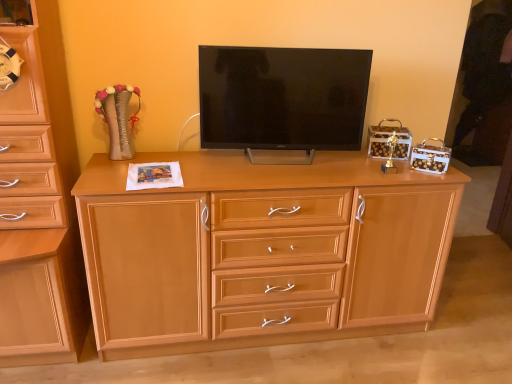
You are a GUI agent. You are given a task and a screenshot of the screen. Output one action in this format:
    pyautogui.click(x=<x>, y=<y>)
    Task: Click on the free location above light wood chest of drawers at center, which appears as the 1th chest of drawers when viewed from the right (from a real-world perspective)
    
    Given the screenshot: What is the action you would take?
    pyautogui.click(x=257, y=164)